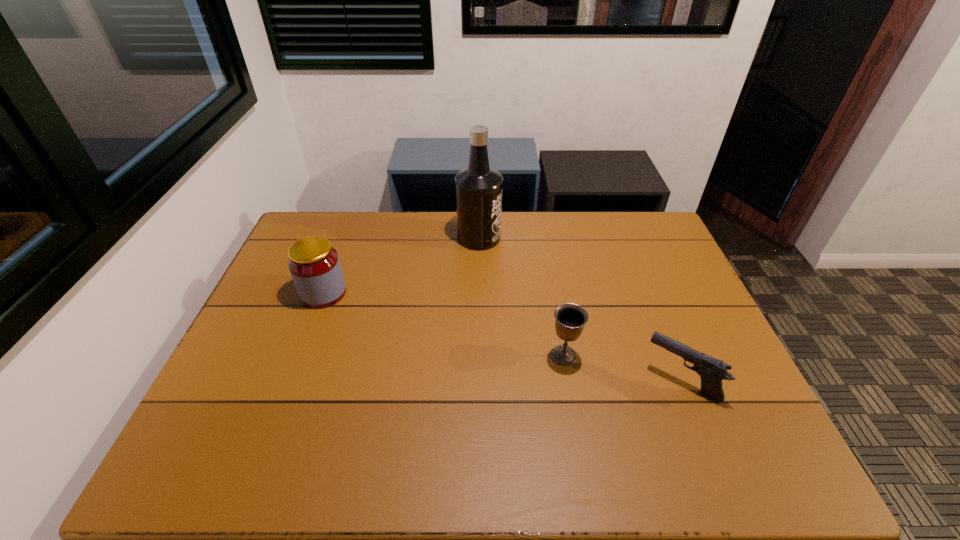
At what (x,y) coordinates should I click in order to perform the action: click on vacant space located at the muzzle of the gun. Please return your answer as a coordinate pair (x, y). Looking at the image, I should click on (614, 381).

The width and height of the screenshot is (960, 540). I want to click on free space located at the muzzle of the gun, so click(x=622, y=381).

What are the coordinates of `free space located at the muzzle of the gun` in the screenshot? It's located at (579, 381).

Find the location of `object that is at the far edge`. object that is at the far edge is located at coordinates (478, 188).

The image size is (960, 540). I want to click on object present at the left edge, so click(314, 264).

Where is `object positioned at the right edge`? The height and width of the screenshot is (540, 960). object positioned at the right edge is located at coordinates (712, 371).

In the image, there is a desktop. In order to click on vacant space at the far edge in this screenshot , I will do `click(554, 224)`.

Identify the location of vacant point at the near edge. This screenshot has height=540, width=960. (424, 479).

In order to click on blank space at the left edge of the desktop in this screenshot , I will do `click(271, 319)`.

The image size is (960, 540). Find the location of `vacant space at the right edge`. vacant space at the right edge is located at coordinates (738, 429).